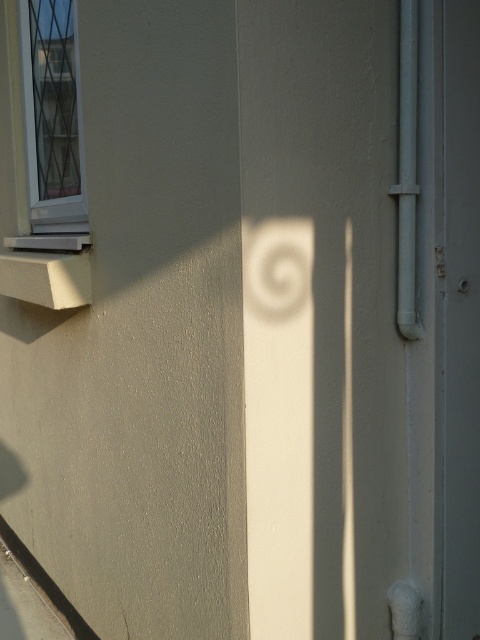
You are an architect analyzing this wall. You need to install a new fixture that requires knowing which object is taller between the white plastic window at upper left and the smooth gray pipe at right. Based on the scene, which one is taller?

The white plastic window at upper left is taller than the smooth gray pipe at right according to the description.

You are a painter assessing the wall for a mural. You notice the smooth gray pipe at right and the white matte plaster bandage at lower right. Which object should you avoid painting over to ensure the mural remains intact? Explain your reasoning.

The smooth gray pipe at right has a larger size compared to the white matte plaster bandage at lower right, so it would require more paint and might be a structural element. Avoid painting over the smooth gray pipe at right to prevent potential damage or obstruction.